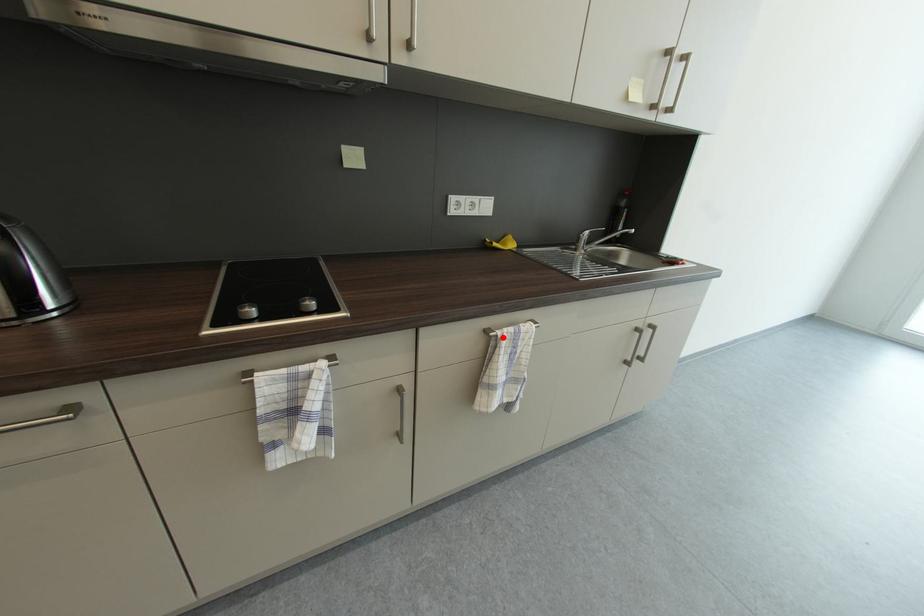
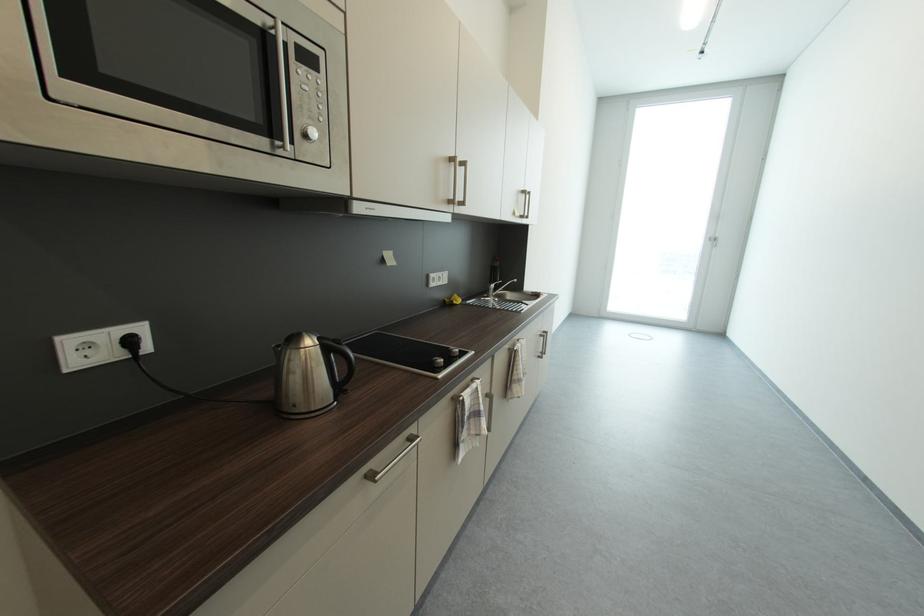
In the second image, find the point that corresponds to the highlighted location in the first image.

(523, 351)